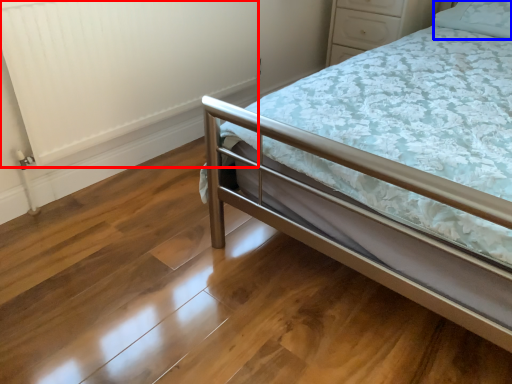
Question: Which object appears farthest to the camera in this image, radiator (highlighted by a red box) or pillow (highlighted by a blue box)?

Choices:
 (A) radiator
 (B) pillow

Answer: (B)